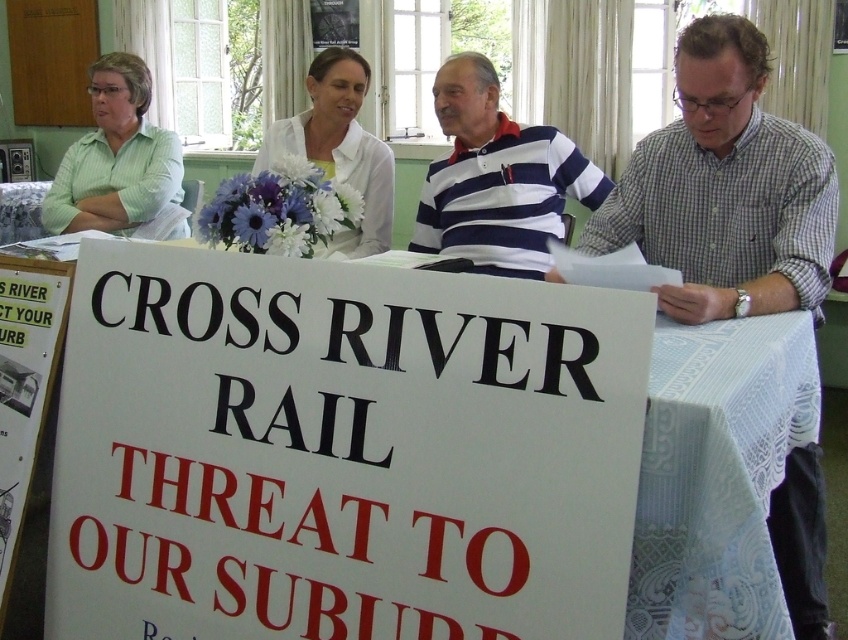
Is white striped polo shirt at center behind green striped shirt at upper left?

No, white striped polo shirt at center is closer to the viewer.

Can you confirm if white striped polo shirt at center is taller than green striped shirt at upper left?

Incorrect, white striped polo shirt at center's height is not larger of green striped shirt at upper left's.

Image resolution: width=848 pixels, height=640 pixels. In order to click on white striped polo shirt at center in this screenshot , I will do `click(497, 179)`.

The height and width of the screenshot is (640, 848). What do you see at coordinates (497, 179) in the screenshot? I see `white striped polo shirt at center` at bounding box center [497, 179].

The width and height of the screenshot is (848, 640). In order to click on white striped polo shirt at center in this screenshot , I will do `click(497, 179)`.

This screenshot has height=640, width=848. In order to click on white striped polo shirt at center in this screenshot , I will do `click(497, 179)`.

Find the location of a particular element. This screenshot has width=848, height=640. white striped polo shirt at center is located at coordinates (497, 179).

Does point (222, 403) come in front of point (737, 92)?

Yes, it is in front of point (737, 92).

Who is lower down, white lace tablecloth at center or checkered fabric shirt at right?

white lace tablecloth at center is below.

Is point (593, 496) positioned behind point (833, 163)?

No, it is not.

Locate an element on the screen. The height and width of the screenshot is (640, 848). white lace tablecloth at center is located at coordinates (343, 451).